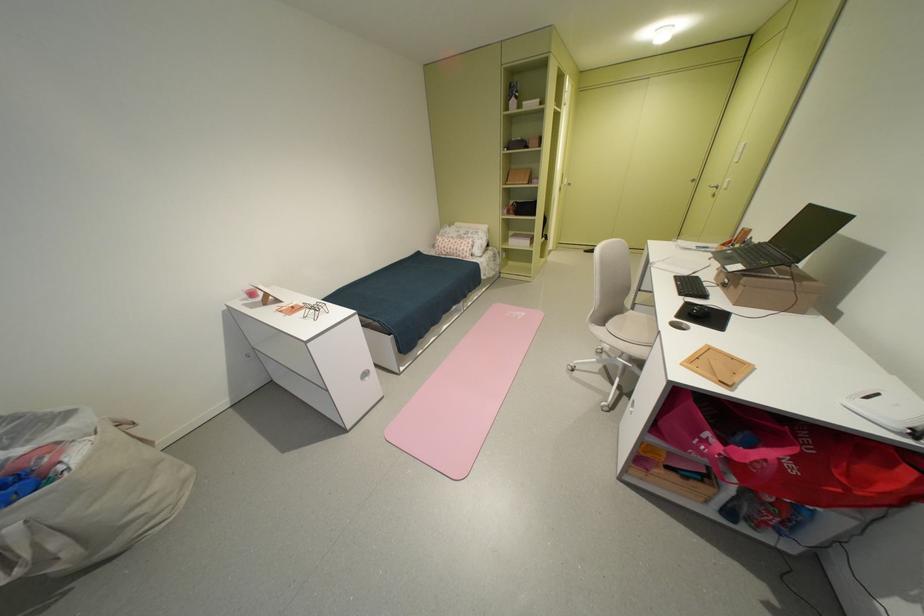
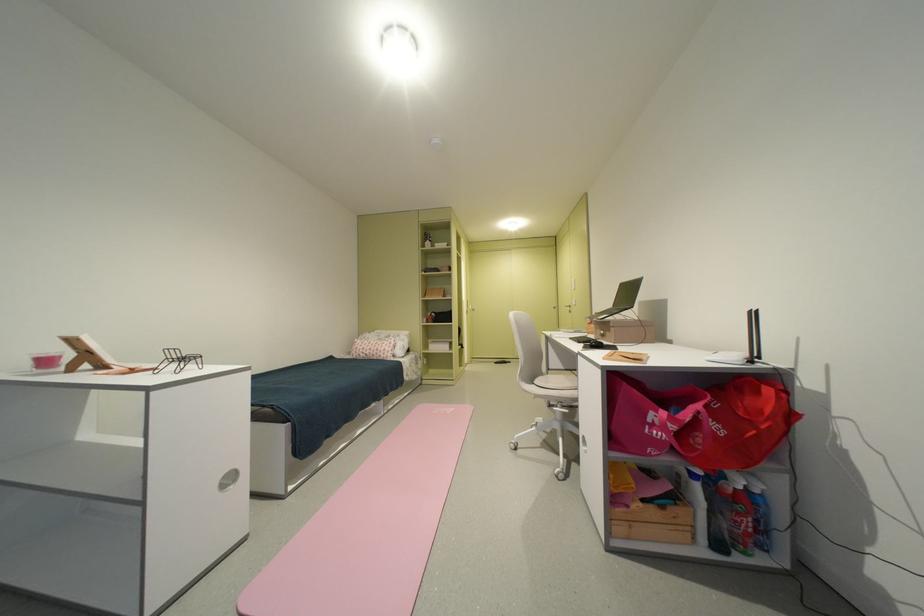
How did the camera likely rotate?

The camera's rotation is toward right-up.